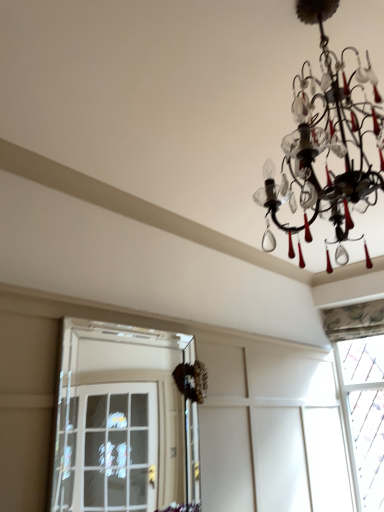
Question: Is black glass chandelier at upper right at the back of clear glass door at left, which ranks as the second window in back-to-front order?

Choices:
 (A) yes
 (B) no

Answer: (B)

Question: From the image's perspective, would you say clear glass door at left, placed as the first window when sorted from front to back, is shown under black glass chandelier at upper right?

Choices:
 (A) yes
 (B) no

Answer: (A)

Question: Would you consider clear glass door at left, marked as the 1th window in a left-to-right arrangement, to be distant from black glass chandelier at upper right?

Choices:
 (A) no
 (B) yes

Answer: (B)

Question: Does clear glass door at left, marked as the 1th window in a left-to-right arrangement, have a greater height compared to black glass chandelier at upper right?

Choices:
 (A) yes
 (B) no

Answer: (A)

Question: Considering the relative sizes of clear glass door at left, placed as the first window when sorted from front to back, and black glass chandelier at upper right in the image provided, is clear glass door at left, placed as the first window when sorted from front to back, wider than black glass chandelier at upper right?

Choices:
 (A) yes
 (B) no

Answer: (B)

Question: From a real-world perspective, is clear glass door at left, placed as the first window when sorted from front to back, on black glass chandelier at upper right?

Choices:
 (A) no
 (B) yes

Answer: (A)

Question: From a real-world perspective, is patterned fabric curtain at upper right, the first window in the right-to-left sequence, on top of clear glass door at left, marked as the 1th window in a left-to-right arrangement?

Choices:
 (A) yes
 (B) no

Answer: (A)

Question: Can you confirm if patterned fabric curtain at upper right, positioned as the second window in front-to-back order, is taller than clear glass door at left, which ranks as the second window in back-to-front order?

Choices:
 (A) yes
 (B) no

Answer: (A)

Question: Does patterned fabric curtain at upper right, the first window in the right-to-left sequence, turn towards clear glass door at left, which ranks as the second window in back-to-front order?

Choices:
 (A) yes
 (B) no

Answer: (A)

Question: Is patterned fabric curtain at upper right, positioned as the second window in front-to-back order, looking in the opposite direction of clear glass door at left, which is the second window from right to left?

Choices:
 (A) yes
 (B) no

Answer: (B)

Question: Is patterned fabric curtain at upper right, the first window in the right-to-left sequence, at the right side of clear glass door at left, placed as the first window when sorted from front to back?

Choices:
 (A) yes
 (B) no

Answer: (A)

Question: Can you confirm if patterned fabric curtain at upper right, which is the 2th window in left-to-right order, is wider than clear glass door at left, which is the second window from right to left?

Choices:
 (A) no
 (B) yes

Answer: (B)

Question: Is black glass chandelier at upper right completely or partially outside of patterned fabric curtain at upper right, which is the 2th window in left-to-right order?

Choices:
 (A) yes
 (B) no

Answer: (A)